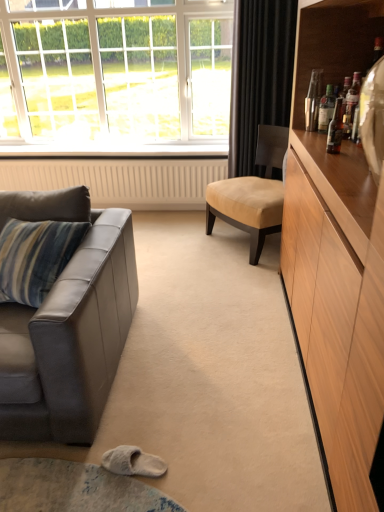
Question: Is leather couch at left inside white glass window at upper left?

Choices:
 (A) no
 (B) yes

Answer: (A)

Question: Is white glass window at upper left positioned beyond the bounds of leather couch at left?

Choices:
 (A) no
 (B) yes

Answer: (B)

Question: Considering the relative sizes of white glass window at upper left and leather couch at left in the image provided, is white glass window at upper left shorter than leather couch at left?

Choices:
 (A) yes
 (B) no

Answer: (B)

Question: From the image's perspective, does white glass window at upper left appear higher than leather couch at left?

Choices:
 (A) no
 (B) yes

Answer: (B)

Question: Is white glass window at upper left at the left side of leather couch at left?

Choices:
 (A) yes
 (B) no

Answer: (B)

Question: Is white glass window at upper left further to camera compared to leather couch at left?

Choices:
 (A) yes
 (B) no

Answer: (A)

Question: Does translucent glass bottle at upper right, arranged as the third bottle when viewed from the back, have a smaller size compared to leather couch at left?

Choices:
 (A) yes
 (B) no

Answer: (A)

Question: Does translucent glass bottle at upper right, arranged as the third bottle when viewed from the back, lie behind leather couch at left?

Choices:
 (A) no
 (B) yes

Answer: (B)

Question: Is translucent glass bottle at upper right, marked as the first bottle in a front-to-back arrangement, positioned far away from leather couch at left?

Choices:
 (A) yes
 (B) no

Answer: (A)

Question: Considering the relative sizes of translucent glass bottle at upper right, arranged as the third bottle when viewed from the back, and leather couch at left in the image provided, is translucent glass bottle at upper right, arranged as the third bottle when viewed from the back, wider than leather couch at left?

Choices:
 (A) no
 (B) yes

Answer: (A)

Question: Does translucent glass bottle at upper right, arranged as the third bottle when viewed from the back, appear on the left side of leather couch at left?

Choices:
 (A) no
 (B) yes

Answer: (A)

Question: Is translucent glass bottle at upper right, marked as the first bottle in a front-to-back arrangement, completely or partially outside of leather couch at left?

Choices:
 (A) yes
 (B) no

Answer: (A)

Question: Is leather couch at left at the left side of translucent glass bottle at upper right, arranged as the third bottle when viewed from the back?

Choices:
 (A) no
 (B) yes

Answer: (B)